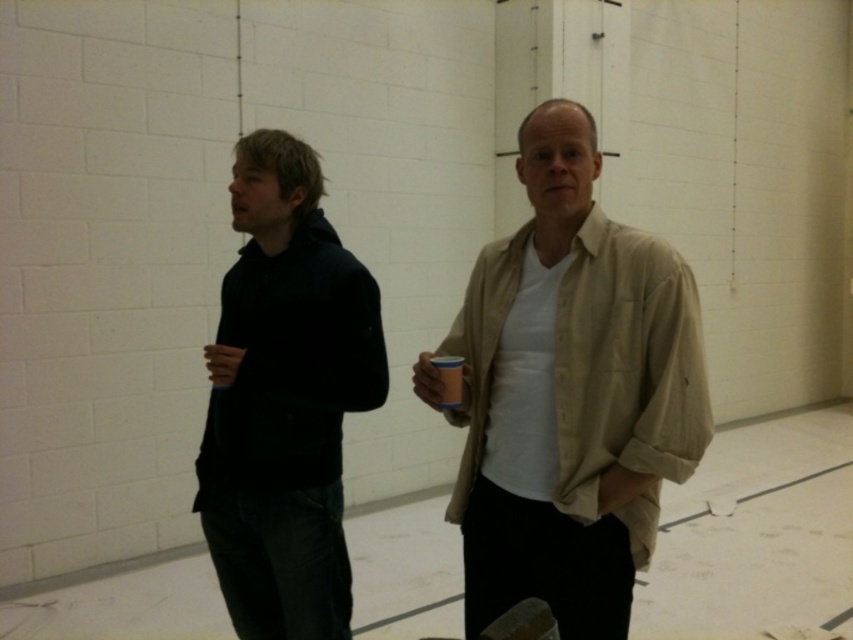
You are a photographer setting up a shoot in this indoor space. You need to position the beige cotton shirt at center and the dark blue hoodie at left so that both subjects are visible in the frame. Given their heights, which subject should you place closer to the camera to ensure both appear balanced in size?

The beige cotton shirt at center has a lesser height compared to the dark blue hoodie at left, so you should place the beige cotton shirt at center closer to the camera to balance their apparent sizes in the photo.

You are organizing a charity clothing drive and need to determine which of the two items, the beige cotton shirt at center or the dark blue hoodie at left, can fit into a standard donation box that requires items to be smaller than the other. Which item should you choose?

The dark blue hoodie at left should be chosen because the beige cotton shirt at center is bigger than it, making the hoodie smaller and thus suitable for the donation box.